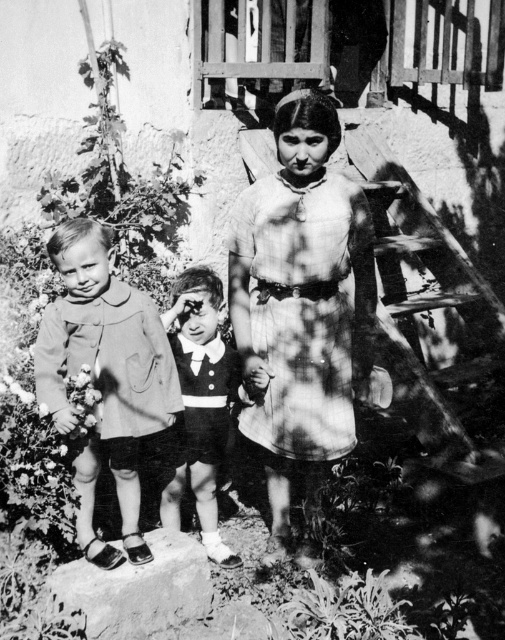
This screenshot has width=505, height=640. What do you see at coordinates (303, 308) in the screenshot? I see `plaid fabric dress at center` at bounding box center [303, 308].

Looking at this image, measure the distance between plaid fabric dress at center and matte brown coat at left.

The distance of plaid fabric dress at center from matte brown coat at left is 27.86 inches.

Is point (368, 364) farther from viewer compared to point (76, 276)?

Yes, point (368, 364) is farther from viewer.

Image resolution: width=505 pixels, height=640 pixels. In order to click on plaid fabric dress at center in this screenshot , I will do `click(303, 308)`.

Which is in front, point (304, 157) or point (210, 321)?

Positioned in front is point (304, 157).

Which is in front, point (322, 353) or point (193, 342)?

Point (322, 353) is in front.

Where is `plaid fabric dress at center`? The width and height of the screenshot is (505, 640). plaid fabric dress at center is located at coordinates click(x=303, y=308).

Locate an element on the screen. This screenshot has width=505, height=640. plaid fabric dress at center is located at coordinates (303, 308).

Find the location of a particular element. plaid fabric dress at center is located at coordinates (303, 308).